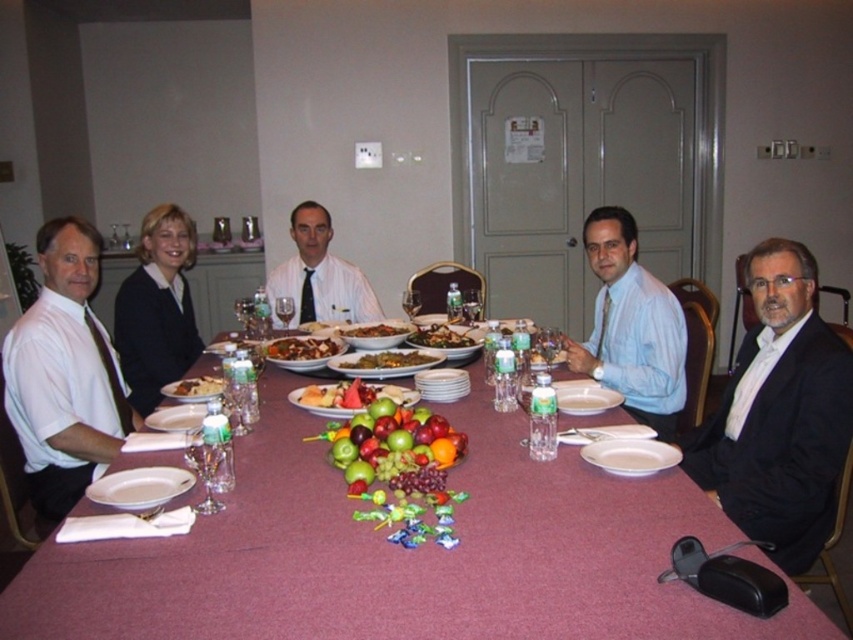
Question: Which of the following is the closest to the observer?

Choices:
 (A) brown glossy meat at center
 (B) light blue shirt at center

Answer: (B)

Question: Can you confirm if green leafy vegetables at center is smaller than smooth white cheese at center?

Choices:
 (A) yes
 (B) no

Answer: (B)

Question: Observing the image, what is the correct spatial positioning of black suit at right in reference to brown matte rice at center?

Choices:
 (A) below
 (B) above

Answer: (A)

Question: Which point is closer to the camera?

Choices:
 (A) (305, 404)
 (B) (187, 396)
 (C) (418, 332)
 (D) (48, 436)

Answer: (D)

Question: Among these objects, which one is nearest to the camera?

Choices:
 (A) sliced fruit at center
 (B) black suit at right
 (C) glossy plastic fruit at center

Answer: (C)

Question: Does light blue shirt at center have a greater width compared to glossy plastic fruit at center?

Choices:
 (A) no
 (B) yes

Answer: (B)